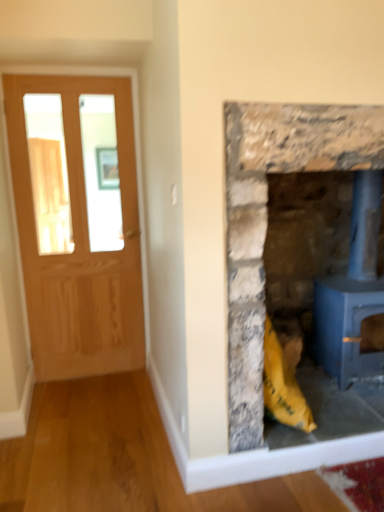
Measure the distance between point (63,85) and camera.

Point (63,85) and camera are 2.60 meters apart.

You are a GUI agent. You are given a task and a screenshot of the screen. Output one action in this format:
    pyautogui.click(x=<x>, y=<y>)
    Task: Click on the blue painted metal wood burning stove at right
    The height and width of the screenshot is (512, 384).
    Given the screenshot: What is the action you would take?
    352,291

You are a GUI agent. You are given a task and a screenshot of the screen. Output one action in this format:
    pyautogui.click(x=<x>, y=<y>)
    Task: Click on the rustic stone fireplace at right
    The image size is (384, 512).
    Given the screenshot: What is the action you would take?
    pyautogui.click(x=285, y=224)

The height and width of the screenshot is (512, 384). Find the location of `matte wooden door at left`. matte wooden door at left is located at coordinates (77, 222).

Which object is further away from the camera taking this photo, rustic stone fireplace at right or blue painted metal wood burning stove at right?

blue painted metal wood burning stove at right is more distant.

Between rustic stone fireplace at right and blue painted metal wood burning stove at right, which one has larger width?

Wider between the two is rustic stone fireplace at right.

Can you tell me how much rustic stone fireplace at right and blue painted metal wood burning stove at right differ in facing direction?

The angle between the facing direction of rustic stone fireplace at right and the facing direction of blue painted metal wood burning stove at right is 0.416 degrees.

Is blue painted metal wood burning stove at right outside of rustic stone fireplace at right?

No, blue painted metal wood burning stove at right is not outside of rustic stone fireplace at right.

Which of these two, blue painted metal wood burning stove at right or rustic stone fireplace at right, is thinner?

blue painted metal wood burning stove at right.

Is blue painted metal wood burning stove at right smaller than rustic stone fireplace at right?

Yes, blue painted metal wood burning stove at right is smaller than rustic stone fireplace at right.

Can you tell me how much blue painted metal wood burning stove at right and rustic stone fireplace at right differ in facing direction?

blue painted metal wood burning stove at right and rustic stone fireplace at right are facing 0.416 degrees away from each other.

From a real-world perspective, is rustic stone fireplace at right above or below matte wooden door at left?

rustic stone fireplace at right is situated lower than matte wooden door at left in the real world.

Considering the positions of objects rustic stone fireplace at right and matte wooden door at left in the image provided, who is in front, rustic stone fireplace at right or matte wooden door at left?

Positioned in front is rustic stone fireplace at right.

Between rustic stone fireplace at right and matte wooden door at left, which one has smaller size?

Smaller between the two is matte wooden door at left.

Between rustic stone fireplace at right and matte wooden door at left, which one has larger width?

With larger width is rustic stone fireplace at right.

Considering the relative sizes of matte wooden door at left and rustic stone fireplace at right in the image provided, is matte wooden door at left taller than rustic stone fireplace at right?

Indeed, matte wooden door at left has a greater height compared to rustic stone fireplace at right.

Which object is more forward, matte wooden door at left or rustic stone fireplace at right?

rustic stone fireplace at right is more forward.

In the scene shown: Are matte wooden door at left and rustic stone fireplace at right making contact?

No, matte wooden door at left is not touching rustic stone fireplace at right.

Is matte wooden door at left oriented away from rustic stone fireplace at right?

No, matte wooden door at left is not facing away from rustic stone fireplace at right.

Who is bigger, blue painted metal wood burning stove at right or matte wooden door at left?

blue painted metal wood burning stove at right.

Does blue painted metal wood burning stove at right lie behind matte wooden door at left?

No.

Identify the location of wood burning stove on the right of matte wooden door at left. (352, 291).

Is point (51, 115) closer to camera compared to point (361, 321)?

No, (51, 115) is behind (361, 321).

Which object is positioned more to the left, matte wooden door at left or blue painted metal wood burning stove at right?

matte wooden door at left.

From a real-world perspective, which is physically above, matte wooden door at left or blue painted metal wood burning stove at right?

matte wooden door at left.

Considering their positions, is matte wooden door at left located in front of or behind blue painted metal wood burning stove at right?

Clearly, matte wooden door at left is behind blue painted metal wood burning stove at right.

Where is `wood burning stove that is behind the rustic stone fireplace at right`? wood burning stove that is behind the rustic stone fireplace at right is located at coordinates (352, 291).

I want to click on wood burning stove below the rustic stone fireplace at right (from a real-world perspective), so click(x=352, y=291).

Based on their spatial positions, is blue painted metal wood burning stove at right or rustic stone fireplace at right further from matte wooden door at left?

blue painted metal wood burning stove at right.

Considering their positions, is matte wooden door at left positioned further to rustic stone fireplace at right than blue painted metal wood burning stove at right?

Among the two, matte wooden door at left is located further to rustic stone fireplace at right.

Based on their spatial positions, is rustic stone fireplace at right or matte wooden door at left closer to blue painted metal wood burning stove at right?

Among the two, rustic stone fireplace at right is located nearer to blue painted metal wood burning stove at right.

In the scene shown: Based on their spatial positions, is blue painted metal wood burning stove at right or matte wooden door at left further from rustic stone fireplace at right?

Based on the image, matte wooden door at left appears to be further to rustic stone fireplace at right.

Looking at the image, which one is located further to blue painted metal wood burning stove at right, matte wooden door at left or rustic stone fireplace at right?

matte wooden door at left.

From the image, which object appears to be nearer to matte wooden door at left, rustic stone fireplace at right or blue painted metal wood burning stove at right?

rustic stone fireplace at right.

At what (x,y) coordinates should I click in order to perform the action: click on fireplace located between matte wooden door at left and blue painted metal wood burning stove at right in the left-right direction. Please return your answer as a coordinate pair (x, y). This screenshot has width=384, height=512. Looking at the image, I should click on click(x=285, y=224).